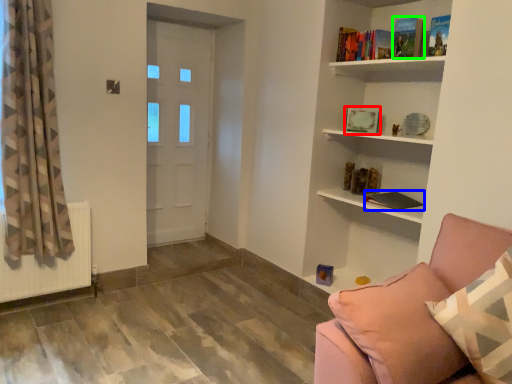
Question: Based on their relative distances, which object is nearer to book (highlighted by a red box)? Choose from book (highlighted by a blue box) and book (highlighted by a green box).

Choices:
 (A) book
 (B) book

Answer: (A)